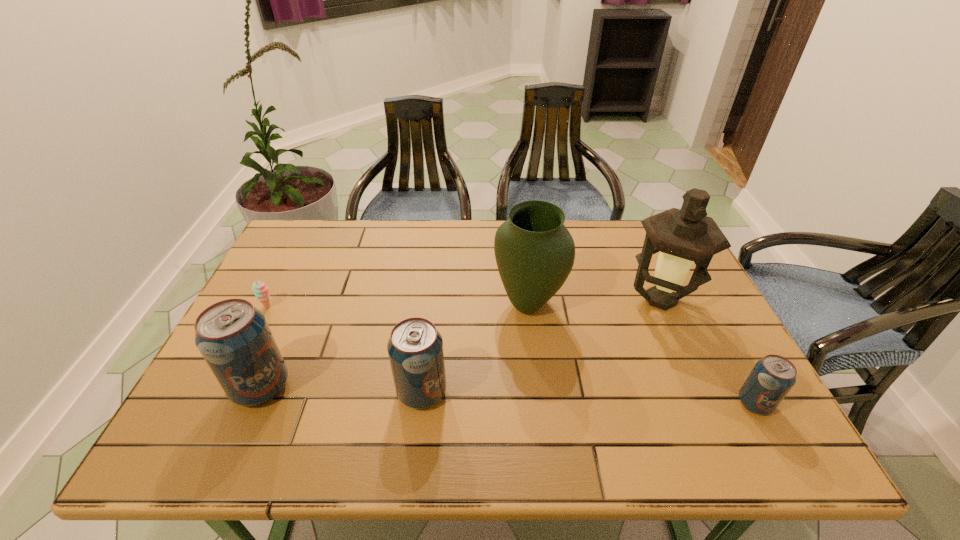
At what (x,y) coordinates should I click in order to perform the action: click on vacant region located 0.240m on the left of the third shortest object. Please return your answer as a coordinate pair (x, y). The height and width of the screenshot is (540, 960). Looking at the image, I should click on pos(291,392).

Where is `free space located on the left of the shortest pop soda`? The width and height of the screenshot is (960, 540). free space located on the left of the shortest pop soda is located at coordinates (558, 403).

The height and width of the screenshot is (540, 960). Identify the location of vacant space located 0.110m on the right of the fourth object from left to right. (604, 304).

I want to click on vacant region located 0.170m on the back of the shortest object, so click(290, 263).

Identify the location of vacant space located 0.200m on the left of the oil lamp. The height and width of the screenshot is (540, 960). (555, 300).

Identify the location of pop soda that is positioned at the left edge. click(234, 338).

This screenshot has height=540, width=960. I want to click on sherbert situated at the left edge, so click(x=260, y=290).

Identify the location of pop soda that is at the right edge. The height and width of the screenshot is (540, 960). (772, 377).

Image resolution: width=960 pixels, height=540 pixels. Find the location of `oil lamp that is at the right edge`. oil lamp that is at the right edge is located at coordinates (682, 236).

This screenshot has width=960, height=540. Find the location of `object positioned at the near left corner`. object positioned at the near left corner is located at coordinates (234, 338).